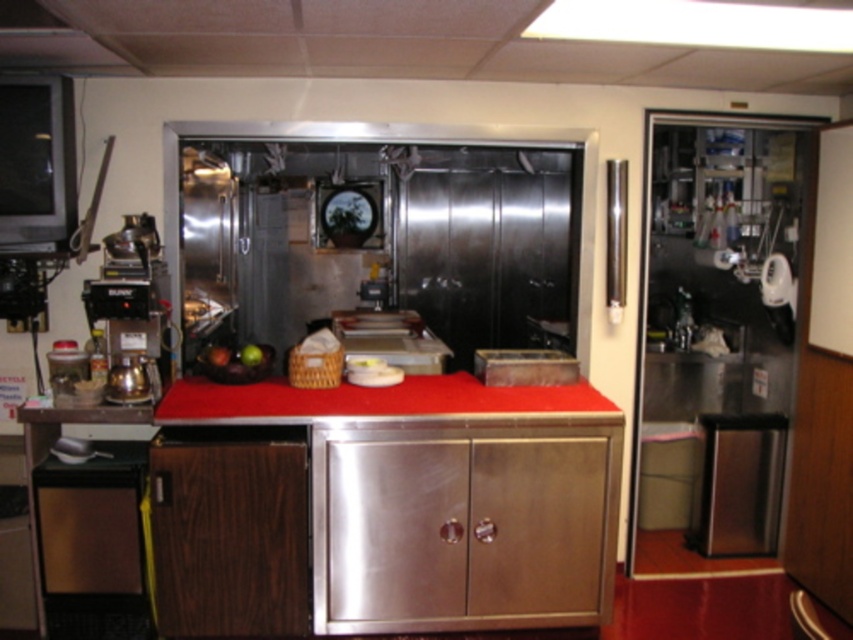
You are a new employee in the kitchen and need to place a tall stack of plates on a surface. The stack is 1.2 meters tall. Can you safely place it on the stainless steel cabinet at center or the red matte counter top at center without it toppling over?

The stainless steel cabinet at center is much taller than the red matte counter top at center, so placing the tall stack of plates on the stainless steel cabinet at center would be safer as it can accommodate the height better without toppling over.

You are a delivery person who just brought a large package to the commercial kitchen. You need to place it on the counter without blocking the stainless steel cabinet at center. Given that the package is 17 inches wide, will it fit on the red matte counter top at center if placed between the cabinet and the edge of the counter?

The stainless steel cabinet at center and red matte counter top at center are 16.95 inches apart. Since the package is 17 inches wide, it will not fit between them as it is slightly wider than the available space.

You are a new employee in the kitchen and need to place a large tray on the surface that can accommodate it. Which object between the stainless steel cabinet at center and the red matte counter top at center should you choose?

The red matte counter top at center is larger than the stainless steel cabinet at center, so you should place the large tray on the red matte counter top at center.